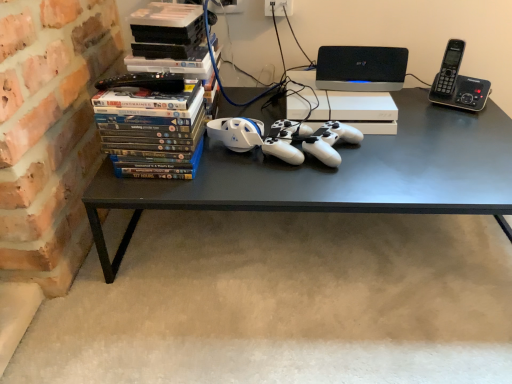
Question: Considering the positions of black plastic phone at upper right and matte plastic dvds at left in the image, is black plastic phone at upper right taller or shorter than matte plastic dvds at left?

Choices:
 (A) short
 (B) tall

Answer: (A)

Question: Relative to matte plastic dvds at left, is black plastic phone at upper right in front or behind?

Choices:
 (A) front
 (B) behind

Answer: (B)

Question: Based on their relative distances, which object is nearer to the black plastic phone at upper right?

Choices:
 (A) matte plastic dvds at left
 (B) black matte desk at center
 (C) black plastic speaker at upper center

Answer: (C)

Question: Estimate the real-world distances between objects in this image. Which object is closer to the black plastic speaker at upper center?

Choices:
 (A) matte plastic dvds at left
 (B) black matte desk at center
 (C) black plastic phone at upper right

Answer: (C)